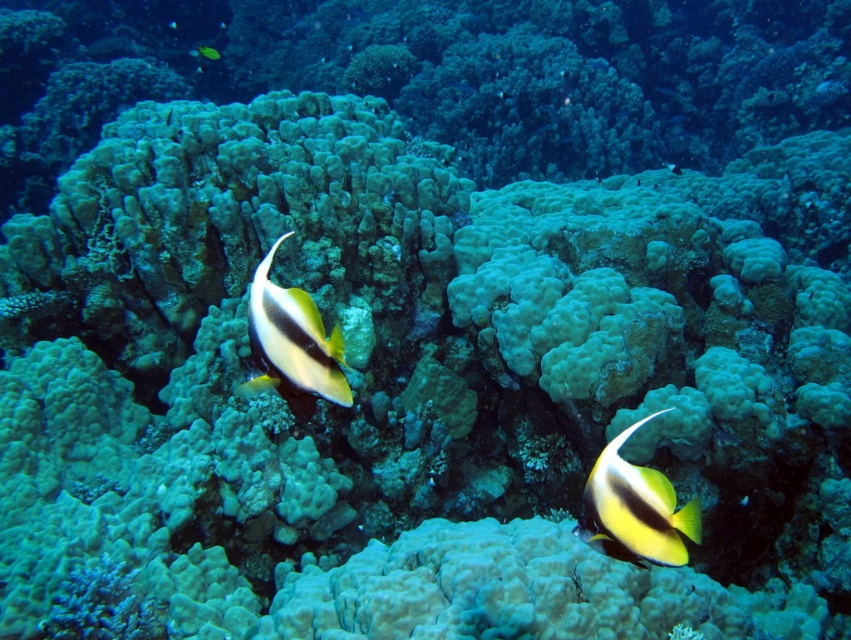
Question: Which object is the farthest from the yellow matte fish at center?

Choices:
 (A) yellow matte fish at lower right
 (B) yellow and black striped fish at center

Answer: (A)

Question: Which point is farther from the camera taking this photo?

Choices:
 (A) (677, 545)
 (B) (315, 376)

Answer: (A)

Question: Is yellow matte fish at lower right below yellow matte fish at center?

Choices:
 (A) no
 (B) yes

Answer: (B)

Question: Does yellow and black striped fish at center have a smaller size compared to yellow matte fish at center?

Choices:
 (A) no
 (B) yes

Answer: (B)

Question: Can you confirm if yellow matte fish at lower right is positioned to the left of yellow matte fish at center?

Choices:
 (A) yes
 (B) no

Answer: (B)

Question: Which of these objects is positioned closest to the yellow matte fish at lower right?

Choices:
 (A) yellow matte fish at center
 (B) yellow and black striped fish at center

Answer: (B)